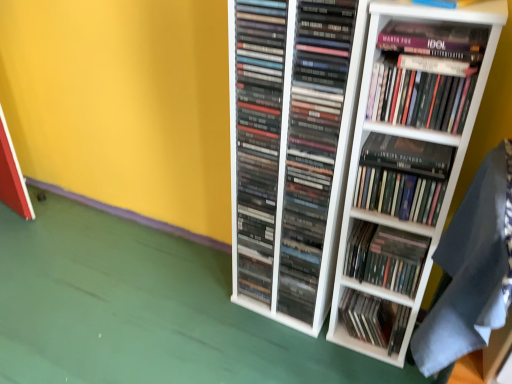
Question: Should I look upward or downward to see matte black books at center, the sixth book when ordered from top to bottom?

Choices:
 (A) up
 (B) down

Answer: (B)

Question: Is the depth of hardcover books at center, positioned as the fourth book in bottom-to-top order, greater than that of matte purple paperback book at upper right?

Choices:
 (A) no
 (B) yes

Answer: (B)

Question: Could matte purple paperback book at upper right be considered to be inside hardcover books at center, positioned as the fourth book in top-to-bottom order?

Choices:
 (A) no
 (B) yes

Answer: (A)

Question: Is hardcover books at center, positioned as the fourth book in top-to-bottom order, at the left side of matte purple paperback book at upper right?

Choices:
 (A) no
 (B) yes

Answer: (B)

Question: Can you confirm if hardcover books at center, positioned as the fourth book in top-to-bottom order, is positioned to the right of matte purple paperback book at upper right?

Choices:
 (A) yes
 (B) no

Answer: (B)

Question: Is the depth of hardcover books at center, positioned as the fourth book in bottom-to-top order, less than that of matte purple paperback book at upper right?

Choices:
 (A) no
 (B) yes

Answer: (A)

Question: From a real-world perspective, is hardcover books at center, positioned as the fourth book in top-to-bottom order, under matte purple paperback book at upper right?

Choices:
 (A) no
 (B) yes

Answer: (B)

Question: Is matte black cds at center, which is the third book from top to bottom, located outside hardcover book at upper right, which ranks as the seventh book in bottom-to-top order?

Choices:
 (A) yes
 (B) no

Answer: (A)

Question: Considering the relative sizes of matte black cds at center, which is the third book from top to bottom, and hardcover book at upper right, which is the 1th book from top to bottom, in the image provided, is matte black cds at center, which is the third book from top to bottom, thinner than hardcover book at upper right, which is the 1th book from top to bottom,?

Choices:
 (A) yes
 (B) no

Answer: (B)

Question: From a real-world perspective, does matte black cds at center, which is the third book from top to bottom, sit lower than hardcover book at upper right, which is the 1th book from top to bottom?

Choices:
 (A) no
 (B) yes

Answer: (B)

Question: Is the depth of matte black cds at center, the fifth book from the bottom, less than that of hardcover book at upper right, which ranks as the seventh book in bottom-to-top order?

Choices:
 (A) no
 (B) yes

Answer: (A)

Question: From the image's perspective, is matte black cds at center, the fifth book from the bottom, beneath hardcover book at upper right, which ranks as the seventh book in bottom-to-top order?

Choices:
 (A) no
 (B) yes

Answer: (B)

Question: From the image's perspective, would you say matte black cds at center, the fifth book from the bottom, is positioned over hardcover book at upper right, which is the 1th book from top to bottom?

Choices:
 (A) no
 (B) yes

Answer: (A)

Question: Is black matte book at upper right, which appears as the 6th book when ordered from the bottom, completely or partially inside matte black books at center, which is the second book from bottom to top?

Choices:
 (A) no
 (B) yes

Answer: (A)